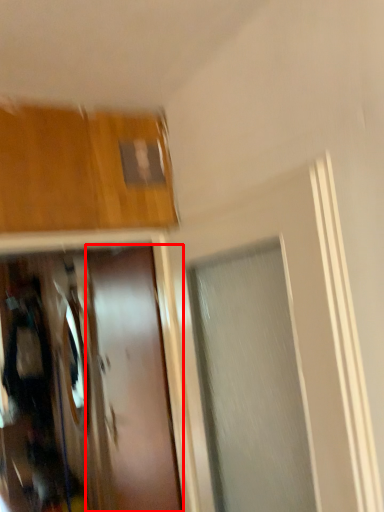
Question: Where is door (annotated by the red box) located in relation to mirror in the image?

Choices:
 (A) right
 (B) left

Answer: (A)